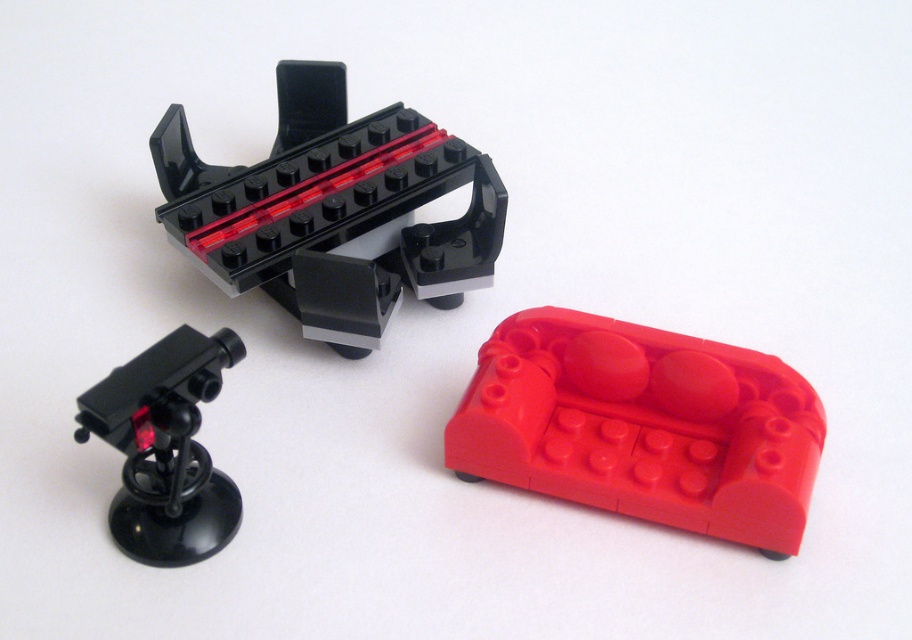
Is point (433, 173) positioned after point (101, 417)?

Yes, point (433, 173) is farther from viewer.

Does point (337, 129) come closer to viewer compared to point (183, 356)?

No, (337, 129) is further to viewer.

Between point (237, 189) and point (118, 541), which one is positioned behind?

The point (237, 189) is behind.

Where is `black plastic/brick at upper center`? black plastic/brick at upper center is located at coordinates (333, 211).

Is rubber red couch at center further to the viewer compared to matte black telescope at upper left?

Yes, rubber red couch at center is behind matte black telescope at upper left.

Does rubber red couch at center have a larger size compared to matte black telescope at upper left?

Yes.

Measure the distance between rubber red couch at center and camera.

rubber red couch at center and camera are 3.73 feet apart from each other.

Locate an element on the screen. The image size is (912, 640). rubber red couch at center is located at coordinates (641, 426).

Is rubber red couch at center to the right of black plastic/brick at upper center from the viewer's perspective?

Indeed, rubber red couch at center is positioned on the right side of black plastic/brick at upper center.

Does point (758, 369) come farther from viewer compared to point (181, 241)?

No, it is not.

Who is more forward, (542, 474) or (298, 208)?

Point (542, 474) is more forward.

Locate an element on the screen. rubber red couch at center is located at coordinates (641, 426).